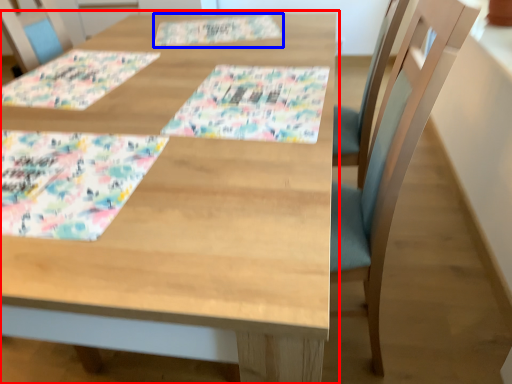
Question: Which object is closer to the camera taking this photo, table (highlighted by a red box) or place mat (highlighted by a blue box)?

Choices:
 (A) table
 (B) place mat

Answer: (A)